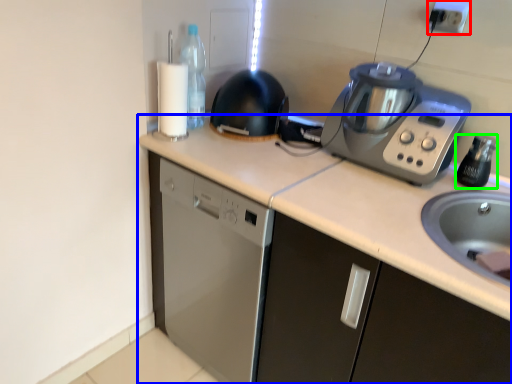
Question: Which is nearer to the electric outlet (highlighted by a red box)? countertop (highlighted by a blue box) or bottle (highlighted by a green box).

Choices:
 (A) countertop
 (B) bottle

Answer: (B)